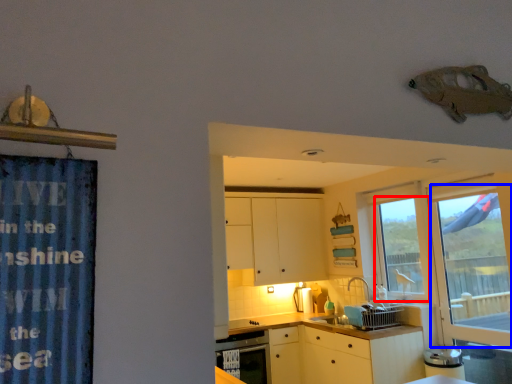
Question: Which point is closer to the camera, window (highlighted by a red box) or glass door (highlighted by a blue box)?

Choices:
 (A) window
 (B) glass door

Answer: (B)